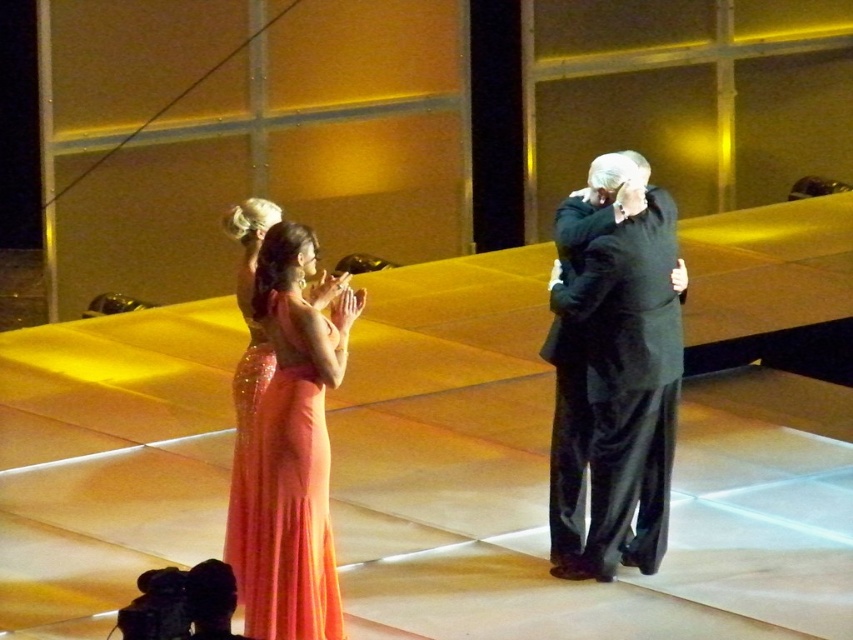
Question: Is dark gray suit at center above shiny coral gown at center?

Choices:
 (A) no
 (B) yes

Answer: (B)

Question: Which point is closer to the camera?

Choices:
 (A) shiny coral gown at center
 (B) dark gray suit at center

Answer: (A)

Question: Which point is farther to the camera?

Choices:
 (A) (285, 376)
 (B) (631, 339)

Answer: (B)

Question: Can you confirm if dark gray suit at center is positioned to the left of shiny coral gown at center?

Choices:
 (A) no
 (B) yes

Answer: (A)

Question: Which of the following is the closest to the observer?

Choices:
 (A) dark gray suit at center
 (B) shiny coral gown at center

Answer: (B)

Question: Is dark gray suit at center positioned in front of shiny coral gown at center?

Choices:
 (A) yes
 (B) no

Answer: (B)